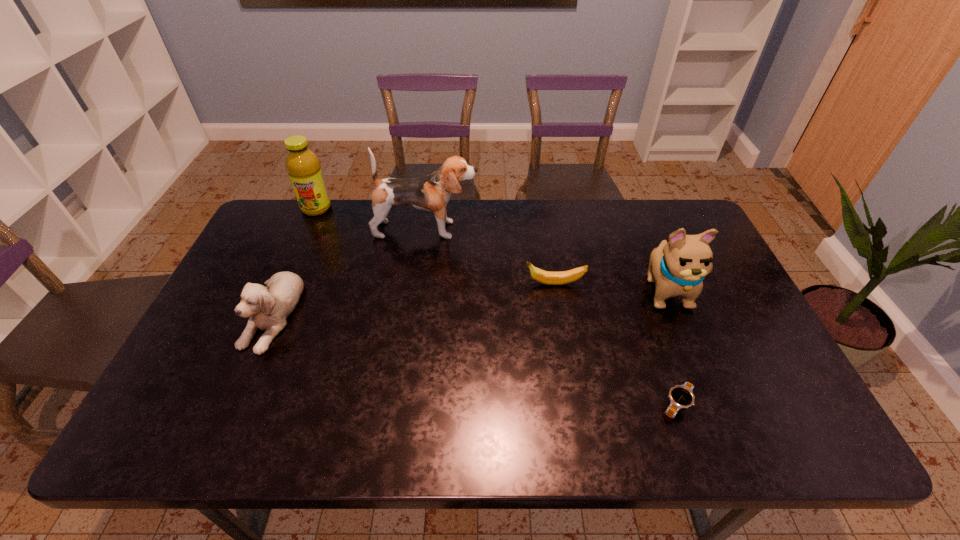
You are a GUI agent. You are given a task and a screenshot of the screen. Output one action in this format:
    pyautogui.click(x=<x>, y=<y>)
    Task: Click on the fourth object from right to left
    The height and width of the screenshot is (540, 960).
    Given the screenshot: What is the action you would take?
    pos(431,193)

The image size is (960, 540). In order to click on the tallest puppy in this screenshot , I will do `click(431, 193)`.

At what (x,y) coordinates should I click in order to perform the action: click on fruit juice. Please return your answer as a coordinate pair (x, y). The height and width of the screenshot is (540, 960). Looking at the image, I should click on (304, 169).

Locate an element on the screen. the rightmost puppy is located at coordinates tap(678, 268).

This screenshot has height=540, width=960. Identify the location of the shortest puppy. (268, 307).

At what (x,y) coordinates should I click in order to perform the action: click on the fourth tallest object. Please return your answer as a coordinate pair (x, y). The height and width of the screenshot is (540, 960). Looking at the image, I should click on (268, 307).

Locate an element on the screen. This screenshot has height=540, width=960. the fourth object from left to right is located at coordinates (550, 278).

Locate an element on the screen. Image resolution: width=960 pixels, height=540 pixels. banana is located at coordinates (550, 278).

Where is `the nearest object`? The image size is (960, 540). the nearest object is located at coordinates (681, 396).

At what (x,y) coordinates should I click in order to perform the action: click on watch. Please return your answer as a coordinate pair (x, y). The width and height of the screenshot is (960, 540). Looking at the image, I should click on (681, 396).